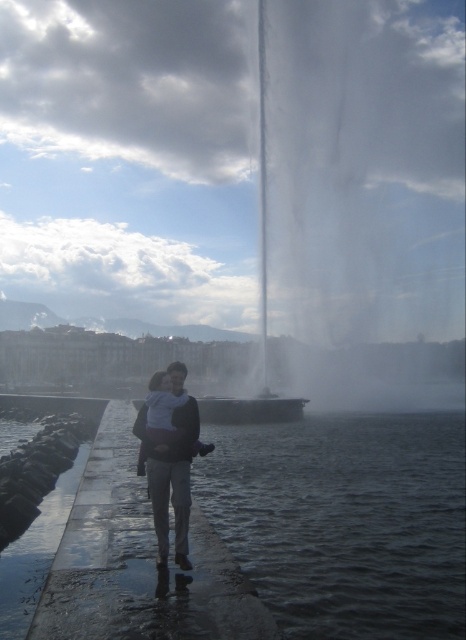
You are a photographer standing at the end of the stone pathway. You want to take a photo of the white soft baby at center and the clear water at pier center. Which object should you focus on first to ensure both are in focus?

The white soft baby at center is behind the clear water at pier center, so you should focus on the white soft baby at center first to ensure both are in focus.